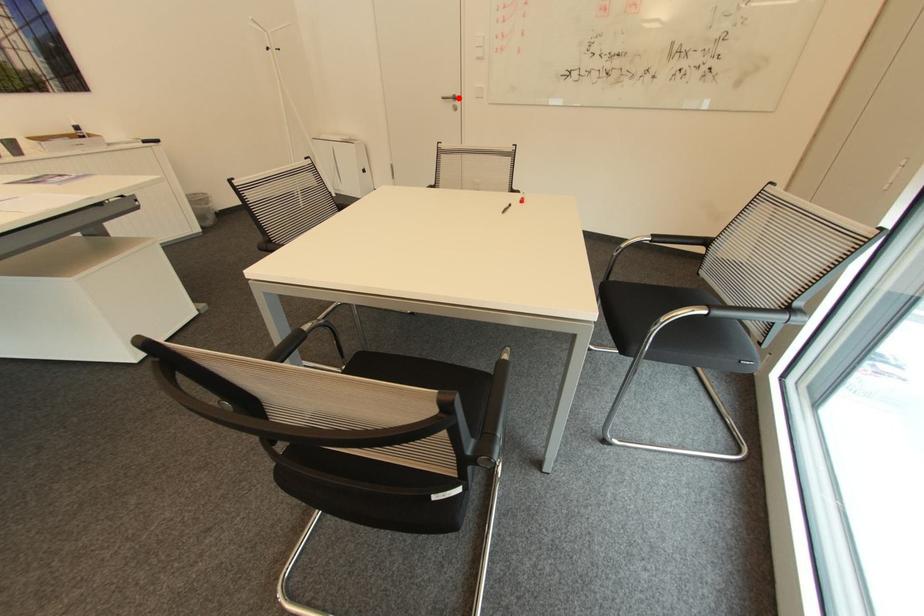
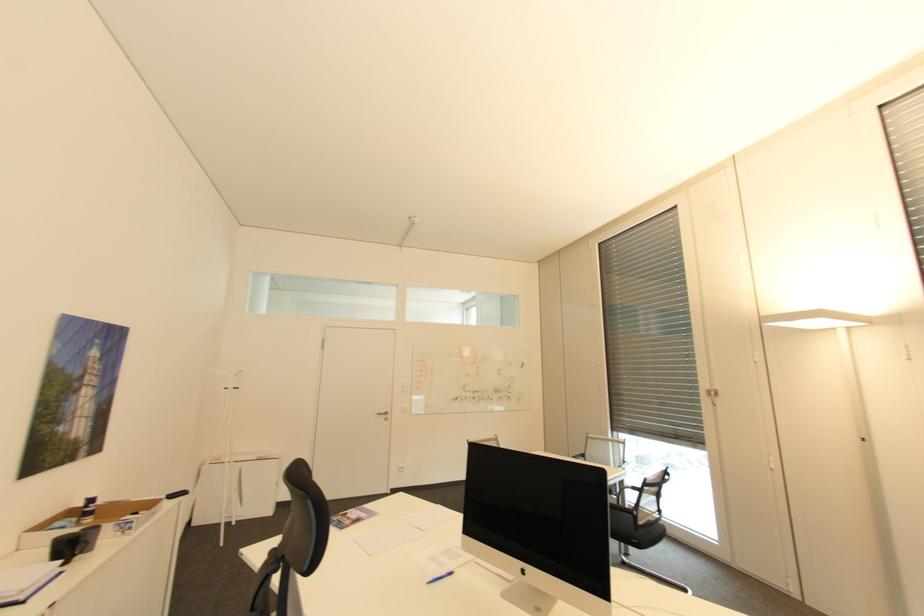
Question: I am providing you with two images of the same scene from different viewpoints. Image1 has a red point marked. In image2, the corresponding 3D location appears at what relative position? Reply with the corresponding letter.

Choices:
 (A) Closer
 (B) Farther

Answer: (B)